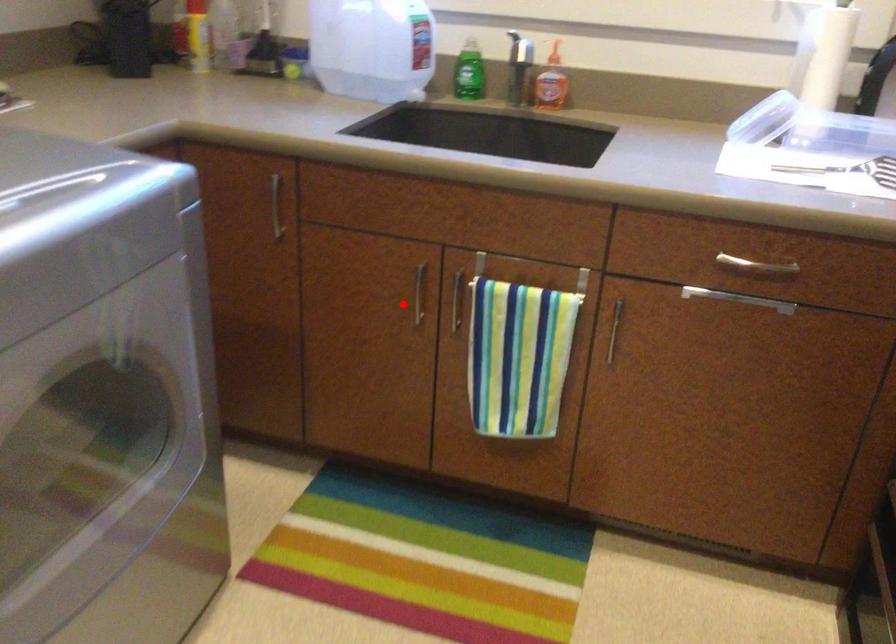
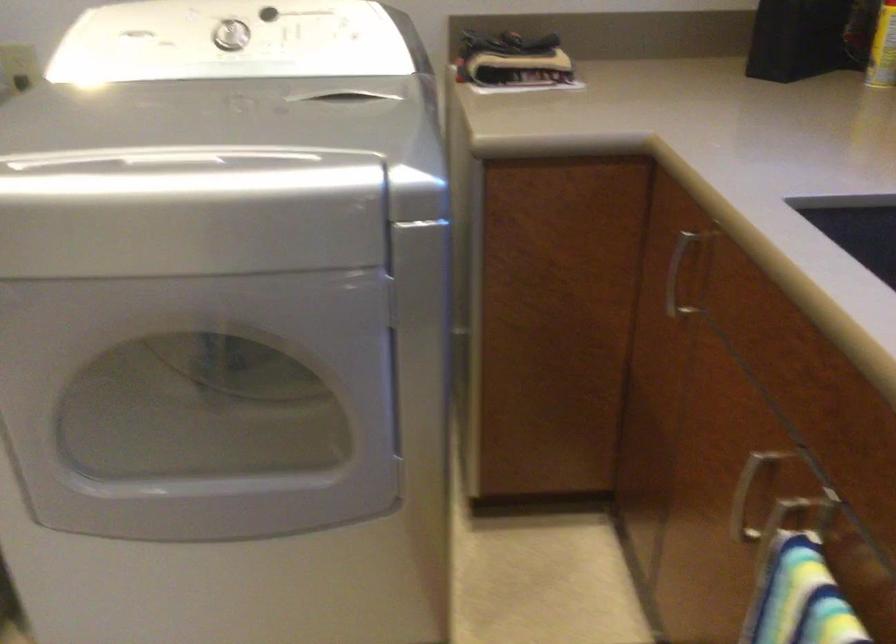
Question: A red point is marked in image1. In image2, is the corresponding 3D point closer to the camera or farther? Reply with the corresponding letter.

Choices:
 (A) The corresponding 3D point is closer.
 (B) The corresponding 3D point is farther.

Answer: (A)